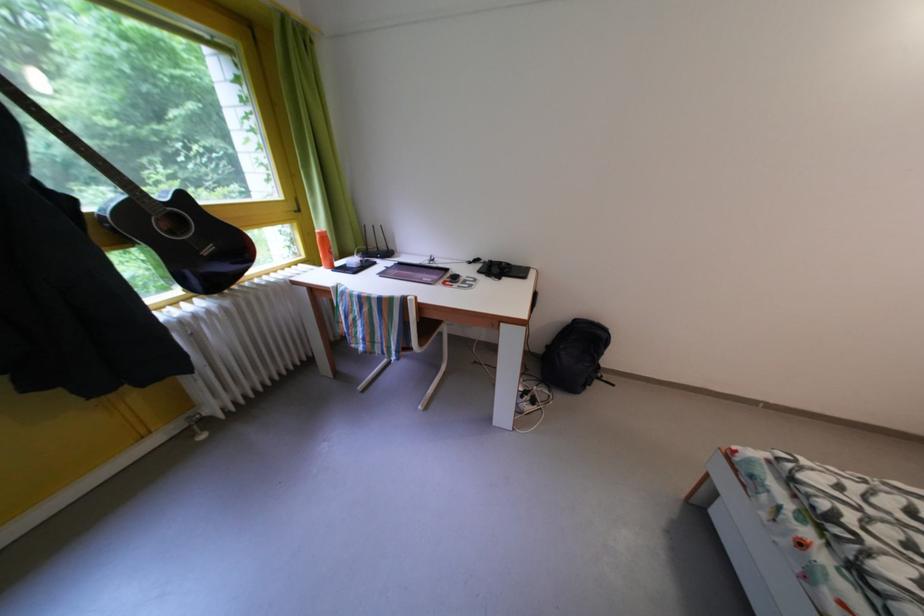
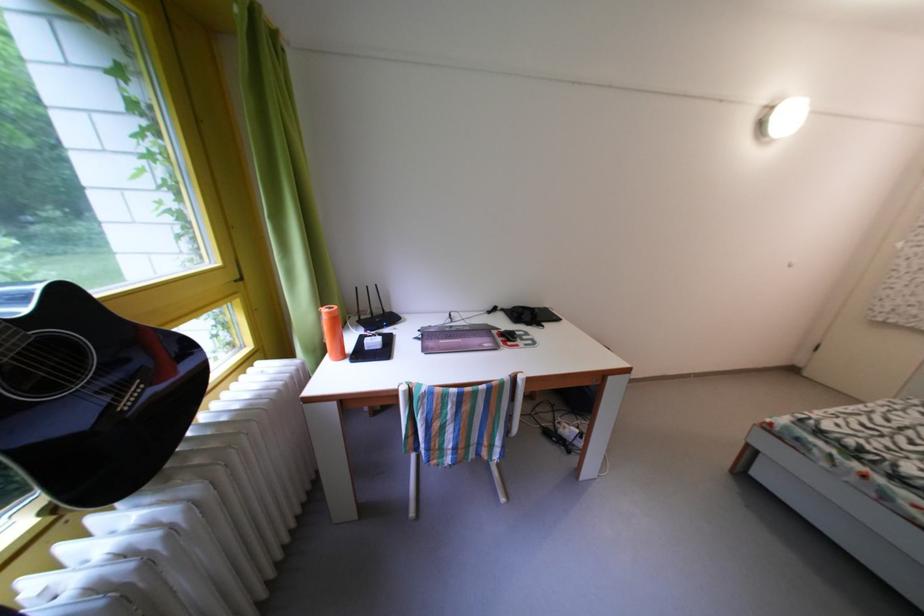
The images are taken continuously from a first-person perspective. In which direction are you moving?

The movement direction of the cameraman is left, forward.